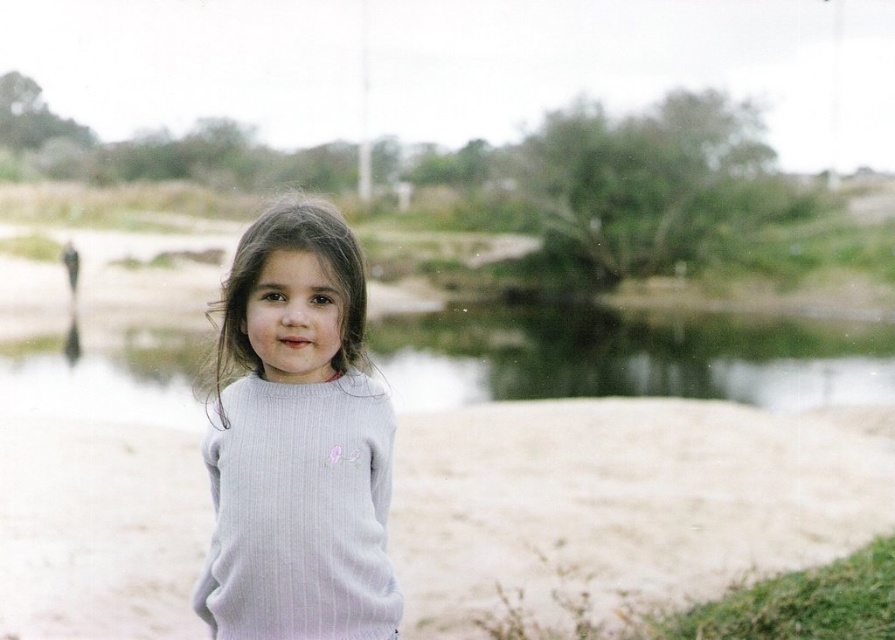
You are a photographer who wants to capture a clear shot of the child in the scene. Since the light gray ribbed sweater at center and green water at center are both at the center, which one is closer to the camera?

The light gray ribbed sweater at center is located below the green water at center, so the sweater is closer to the camera than the water.

You are a photographer who wants to capture a closeup of the light gray ribbed sweater at center and the green water at center. Given that the sweater is smaller than the water, which object should you zoom in on to ensure both are clearly visible in the frame?

Since the light gray ribbed sweater at center is smaller than the green water at center, you should zoom in on the sweater to ensure both objects are clearly visible in the frame.

You are a photographer trying to capture a closeup of the child while ensuring both the white sand at center and green water at center are visible in the frame. Based on their positions, which object should you focus on to keep both in focus?

You should focus on the white sand at center because it is closer to the viewer than the green water at center. By focusing on the closer object, the depth of field will extend further back, potentially keeping both the white sand at center and the green water at center in acceptable focus.